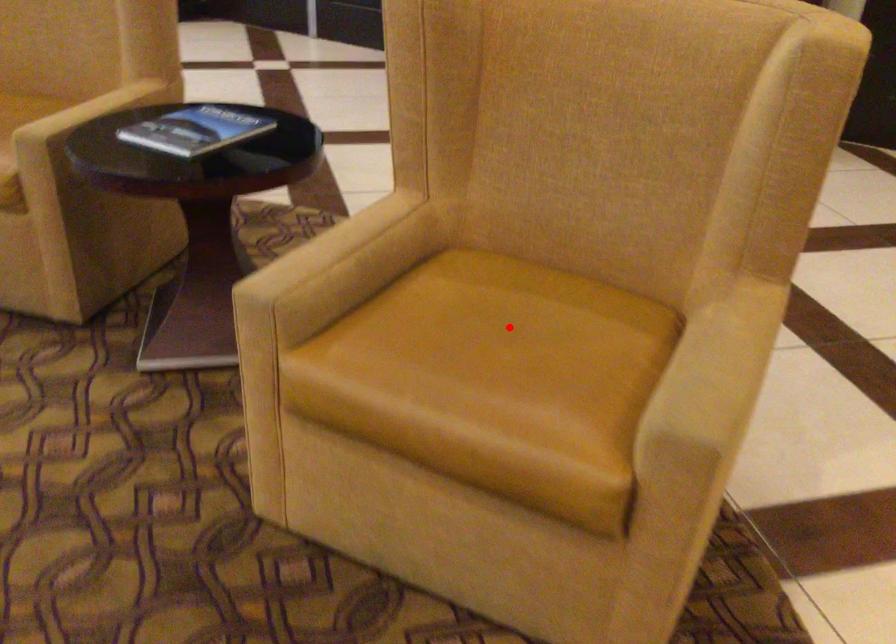
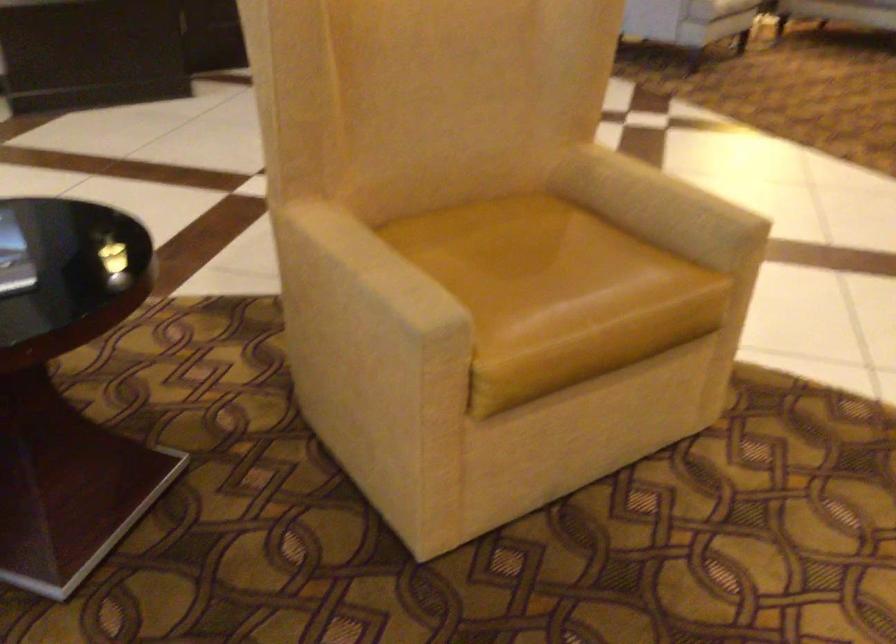
Locate, in the second image, the point that corresponds to the highlighted location in the first image.

(520, 256)